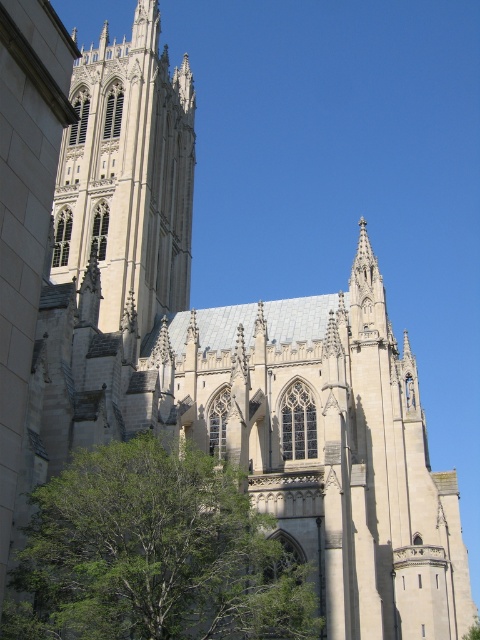
How distant is green leafy tree at lower left from white stone tower at upper left?

green leafy tree at lower left and white stone tower at upper left are 117.76 feet apart.

Does green leafy tree at lower left have a greater width compared to white stone tower at upper left?

No, green leafy tree at lower left is not wider than white stone tower at upper left.

Between point (97, 524) and point (186, 305), which one is positioned in front?

Positioned in front is point (97, 524).

Identify the location of green leafy tree at lower left. (154, 554).